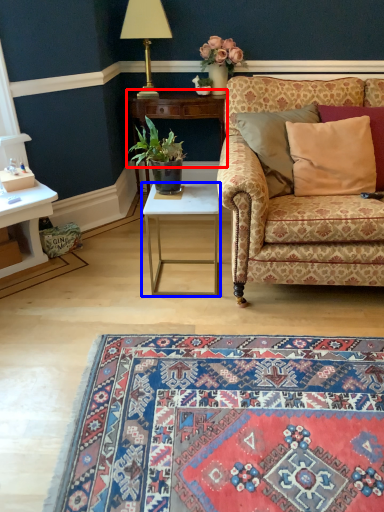
Question: Which point is further to the camera, table (highlighted by a red box) or table (highlighted by a blue box)?

Choices:
 (A) table
 (B) table

Answer: (A)